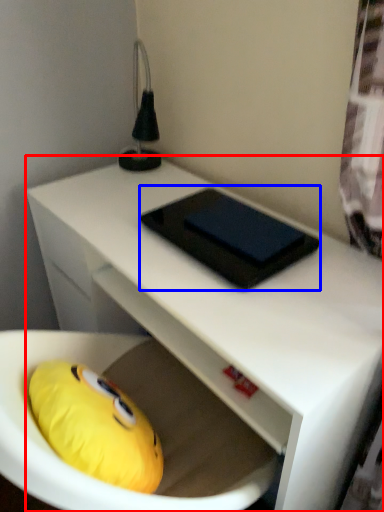
Question: Among these objects, which one is farthest to the camera, desk (highlighted by a red box) or pad (highlighted by a blue box)?

Choices:
 (A) desk
 (B) pad

Answer: (B)